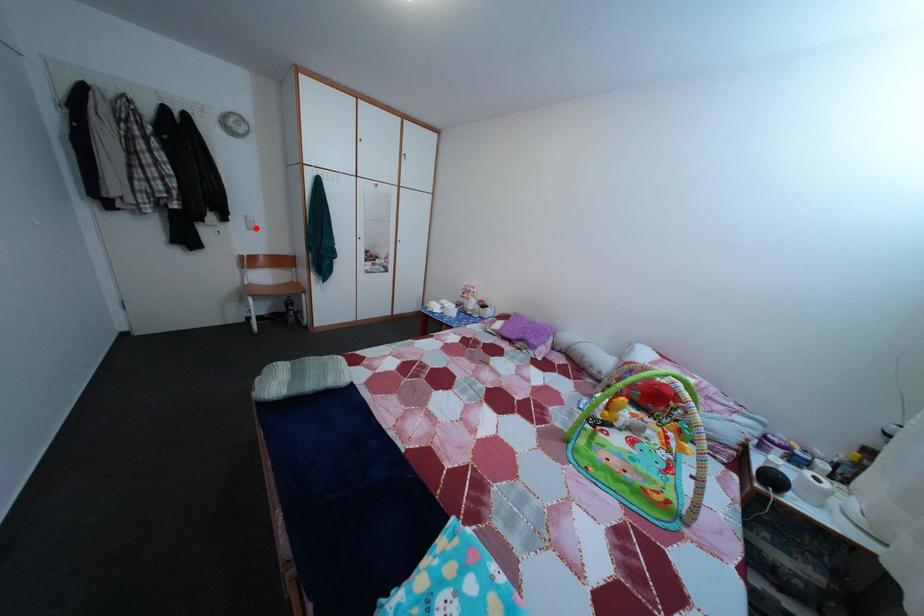
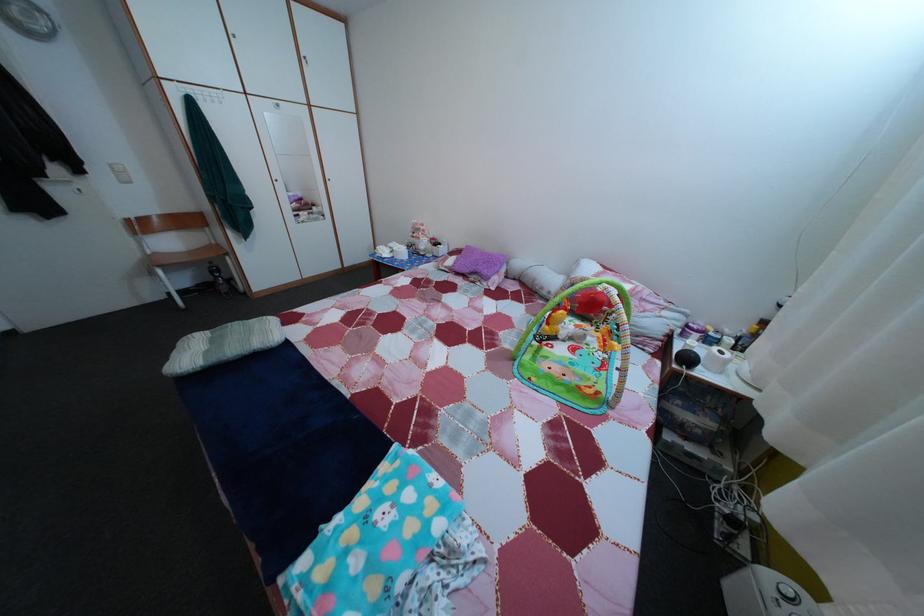
Question: I am providing you with two images of the same scene from different viewpoints. In image1, a red point is highlighted. Considering the same 3D point in image2, which of the following is correct?

Choices:
 (A) It is closer
 (B) It is farther

Answer: (B)